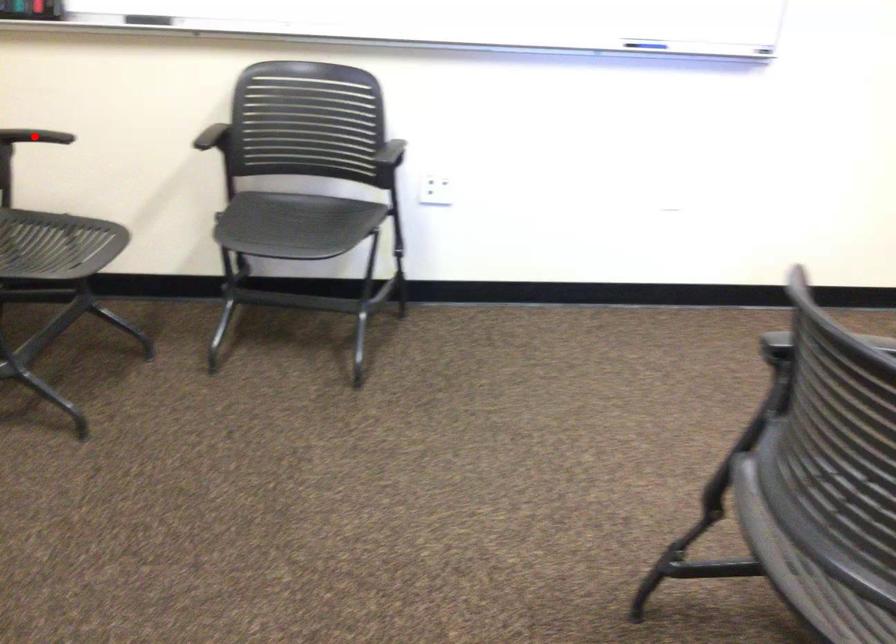
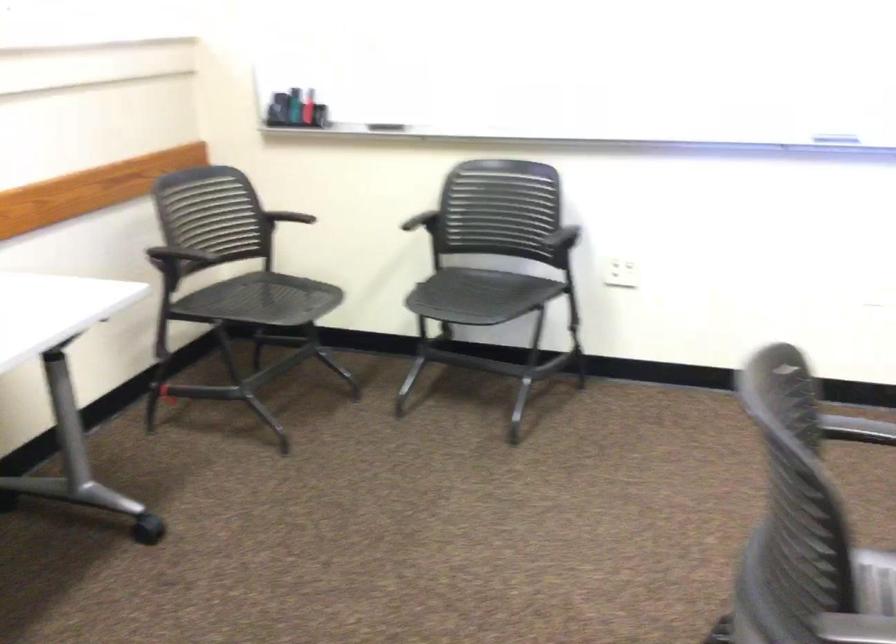
The point at the highlighted location is marked in the first image. Where is the corresponding point in the second image?

(283, 219)